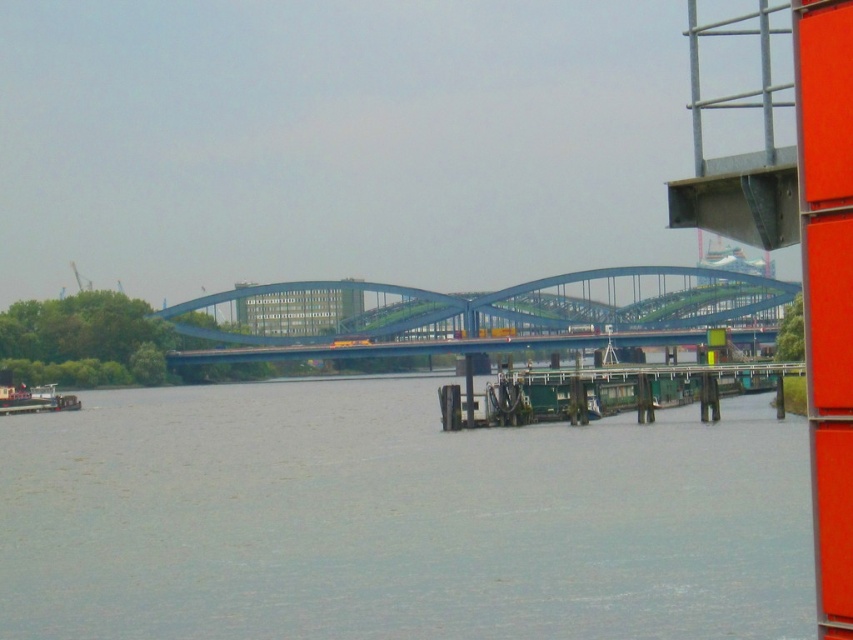
You are standing on the green wooden dock at lower right and want to move to the white plastic boat at lower left. Which direction should you go?

You should move to the left to reach the white plastic boat at lower left from the green wooden dock at lower right because the green wooden dock at lower right is to the right of the white plastic boat at lower left.

Consider the image. You are standing on the white plastic boat at lower left and want to reach the blue metallic bridge at center. Given that the boat can travel at a constant speed of 2 meters per second, how long will it take to reach the bridge?

The blue metallic bridge at center is 43.02 meters away from the white plastic boat at lower left. At a speed of 2 meters per second, it will take approximately 21.51 seconds to reach the bridge.

You are standing at the exact center of the image. Which direction should you look to see the blue metallic bridge at center?

The blue metallic bridge at center is located at point coordinates of approximately 0.492 on the x axis and 0.589 on the y axis. Since you are at the center of the image, which is point coordinates of 0.5 on both axes, the bridge is slightly to the right and above your current position. Therefore, you should look slightly to your right and upward to see the blue metallic bridge at center.